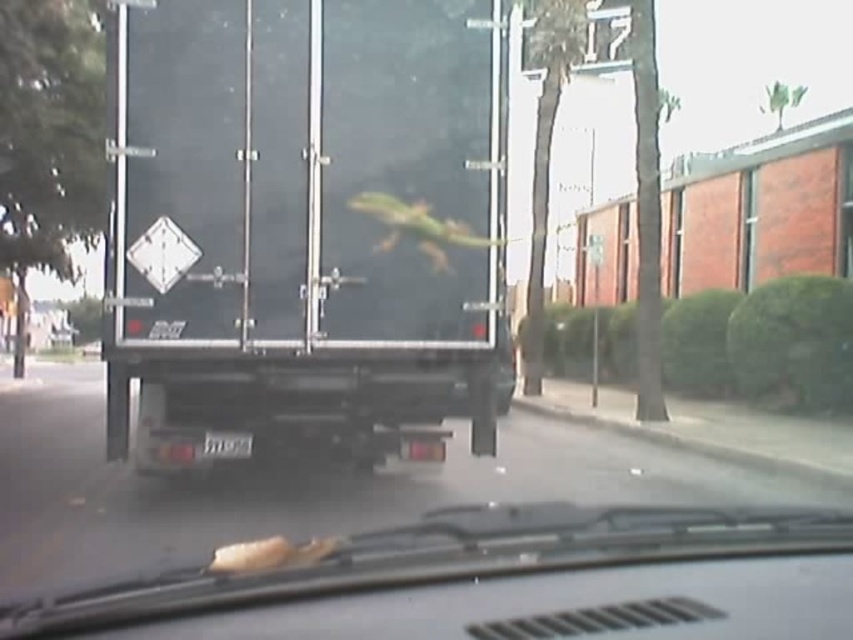
You are a passenger in the vehicle. Looking out the window, you see the black matte trailer truck at center and the metallic gray car at center. Which one is positioned to the left side from your perspective?

The black matte trailer truck at center is positioned to the left of the metallic gray car at center.

You are a passenger in the vehicle and want to know if the point closer to the camera is the one at coordinates point (274, 417) or point (758, 588). Which point is closer to you?

Point (274, 417) is further to the camera than point (758, 588), so the point closer to you is point (758, 588).

You are a delivery driver who needs to park your vehicle in a low clearance garage. You see the black matte trailer truck at center and the metallic gray car at center in the image. Which vehicle should you avoid parking in the garage to prevent hitting the ceiling?

The black matte trailer truck at center has a greater height compared to the metallic gray car at center, so you should avoid parking the black matte trailer truck at center in the garage to prevent hitting the ceiling.